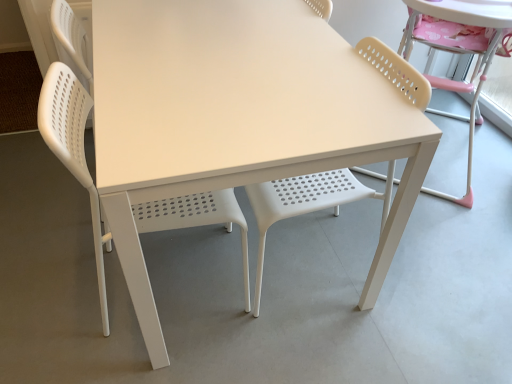
Where is `vacant space positioned to the left of white plastic chair at left, arranged as the 3th chair when viewed from the right`? Image resolution: width=512 pixels, height=384 pixels. vacant space positioned to the left of white plastic chair at left, arranged as the 3th chair when viewed from the right is located at coordinates (54, 280).